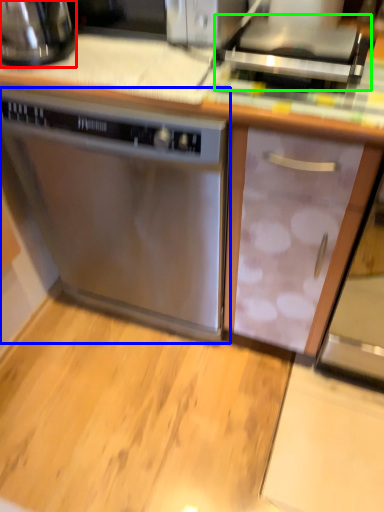
Question: Estimate the real-world distances between objects in this image. Which object is farther from kitchen appliance (highlighted by a red box), home appliance (highlighted by a blue box) or appliance (highlighted by a green box)?

Choices:
 (A) home appliance
 (B) appliance

Answer: (B)